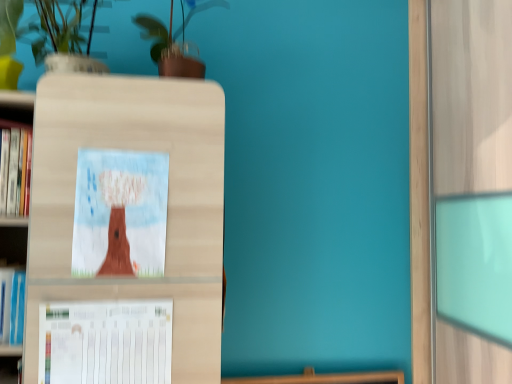
Question: Are green glossy plant at upper center and matte cardboard picture frame at center making contact?

Choices:
 (A) yes
 (B) no

Answer: (B)

Question: Is green glossy plant at upper center oriented towards matte cardboard picture frame at center?

Choices:
 (A) no
 (B) yes

Answer: (A)

Question: Does green glossy plant at upper center have a lesser width compared to matte cardboard picture frame at center?

Choices:
 (A) no
 (B) yes

Answer: (A)

Question: Can you confirm if green glossy plant at upper center is positioned to the right of matte cardboard picture frame at center?

Choices:
 (A) yes
 (B) no

Answer: (A)

Question: Is green glossy plant at upper center taller than matte cardboard picture frame at center?

Choices:
 (A) no
 (B) yes

Answer: (A)

Question: From a real-world perspective, is green glossy plant at upper center over matte cardboard picture frame at center?

Choices:
 (A) yes
 (B) no

Answer: (A)

Question: Is white matte vase at upper left at the right side of white paper at lower left?

Choices:
 (A) yes
 (B) no

Answer: (B)

Question: Is white matte vase at upper left positioned beyond the bounds of white paper at lower left?

Choices:
 (A) yes
 (B) no

Answer: (A)

Question: Is white matte vase at upper left taller than white paper at lower left?

Choices:
 (A) yes
 (B) no

Answer: (A)

Question: Is white matte vase at upper left bigger than white paper at lower left?

Choices:
 (A) yes
 (B) no

Answer: (A)

Question: From a real-world perspective, is white matte vase at upper left on white paper at lower left?

Choices:
 (A) no
 (B) yes

Answer: (B)

Question: Can you confirm if white matte vase at upper left is thinner than white paper at lower left?

Choices:
 (A) no
 (B) yes

Answer: (A)

Question: Does matte cardboard picture frame at center have a greater width compared to white matte vase at upper left?

Choices:
 (A) no
 (B) yes

Answer: (A)